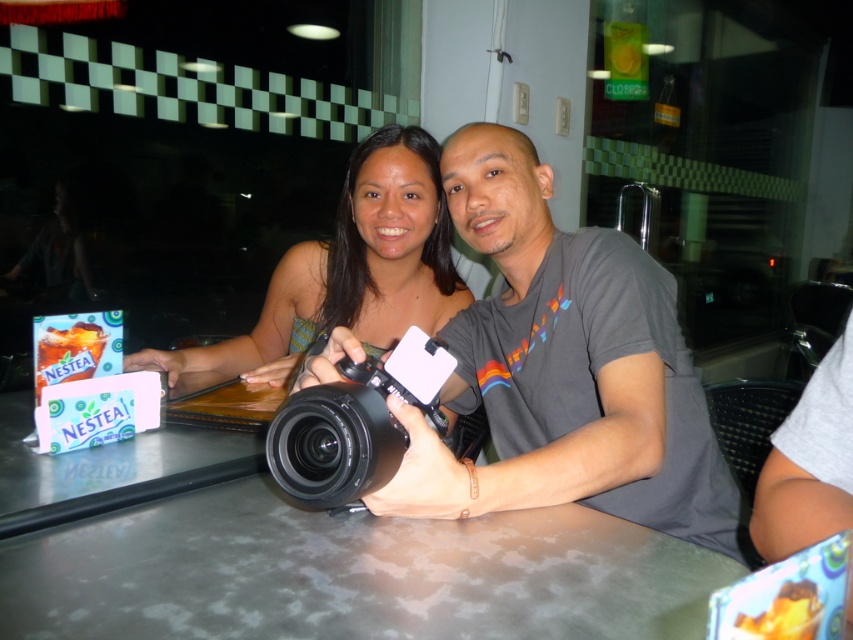
Does black matte camera at center appear over black plastic video camera at center?

Yes.

Where is `black matte camera at center`? Image resolution: width=853 pixels, height=640 pixels. black matte camera at center is located at coordinates (564, 369).

Locate an element on the screen. The width and height of the screenshot is (853, 640). black matte camera at center is located at coordinates (564, 369).

The height and width of the screenshot is (640, 853). I want to click on black matte camera at center, so click(564, 369).

Who is more distant from viewer, (381, 298) or (318, 445)?

The point (381, 298) is more distant.

Is matte black camera at center shorter than black plastic video camera at center?

Incorrect, matte black camera at center's height does not fall short of black plastic video camera at center's.

The image size is (853, 640). What do you see at coordinates (347, 269) in the screenshot?
I see `matte black camera at center` at bounding box center [347, 269].

Locate an element on the screen. matte black camera at center is located at coordinates (347, 269).

How distant is black matte camera at center from matte black camera at center?

black matte camera at center is 40.63 centimeters from matte black camera at center.

Image resolution: width=853 pixels, height=640 pixels. In order to click on black matte camera at center in this screenshot , I will do `click(564, 369)`.